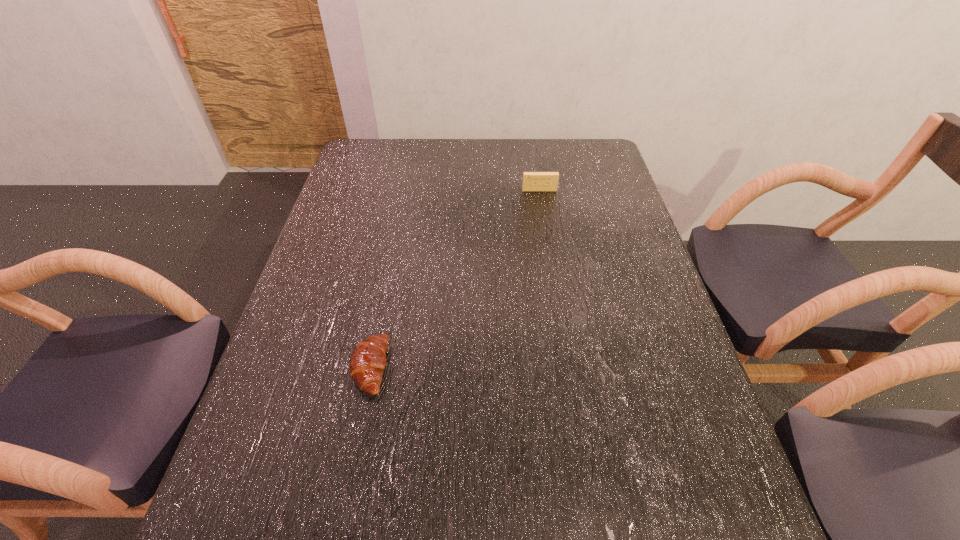
Where is `the farther object`? the farther object is located at coordinates (532, 181).

Locate an element on the screen. This screenshot has width=960, height=540. the taller object is located at coordinates (532, 181).

Where is `the left object`? The width and height of the screenshot is (960, 540). the left object is located at coordinates (368, 360).

The width and height of the screenshot is (960, 540). Find the location of `the shorter object`. the shorter object is located at coordinates (368, 360).

The width and height of the screenshot is (960, 540). What are the coordinates of `vacant region located 0.200m at the front of the farther object with spools` in the screenshot? It's located at point(546,232).

Identify the location of free space located on the back of the shorter object. The height and width of the screenshot is (540, 960). (390, 266).

In the image, there is a desktop. What are the coordinates of `free space at the far edge` in the screenshot? It's located at (431, 173).

I want to click on free space at the left edge of the desktop, so click(x=352, y=184).

Locate an element on the screen. The width and height of the screenshot is (960, 540). free space at the right edge is located at coordinates (598, 181).

Image resolution: width=960 pixels, height=540 pixels. In order to click on vacant space at the far right corner of the desktop in this screenshot , I will do `click(605, 175)`.